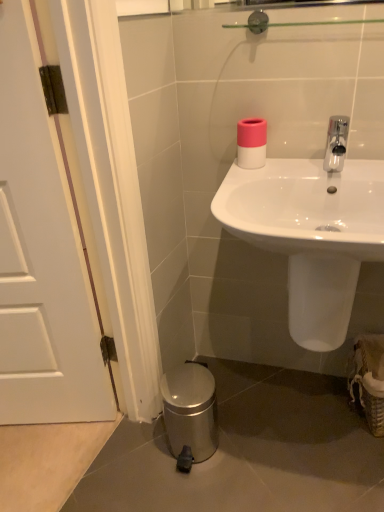
Question: Is woven straw basket at lower right located within polished chrome faucet at upper right?

Choices:
 (A) no
 (B) yes

Answer: (A)

Question: Is polished chrome faucet at upper right closer to the viewer compared to woven straw basket at lower right?

Choices:
 (A) no
 (B) yes

Answer: (B)

Question: From the image's perspective, is polished chrome faucet at upper right under woven straw basket at lower right?

Choices:
 (A) no
 (B) yes

Answer: (A)

Question: From a real-world perspective, is polished chrome faucet at upper right on top of woven straw basket at lower right?

Choices:
 (A) yes
 (B) no

Answer: (A)

Question: Is polished chrome faucet at upper right wider than woven straw basket at lower right?

Choices:
 (A) yes
 (B) no

Answer: (B)

Question: Does polished chrome faucet at upper right have a greater height compared to woven straw basket at lower right?

Choices:
 (A) yes
 (B) no

Answer: (B)

Question: Can you confirm if pink matte toilet paper at upper center is positioned to the right of polished chrome faucet at upper right?

Choices:
 (A) no
 (B) yes

Answer: (A)

Question: Is pink matte toilet paper at upper center shorter than polished chrome faucet at upper right?

Choices:
 (A) yes
 (B) no

Answer: (A)

Question: Considering the relative sizes of pink matte toilet paper at upper center and polished chrome faucet at upper right in the image provided, is pink matte toilet paper at upper center smaller than polished chrome faucet at upper right?

Choices:
 (A) no
 (B) yes

Answer: (B)

Question: Is there a large distance between pink matte toilet paper at upper center and polished chrome faucet at upper right?

Choices:
 (A) yes
 (B) no

Answer: (B)

Question: Considering the relative positions of pink matte toilet paper at upper center and polished chrome faucet at upper right in the image provided, is pink matte toilet paper at upper center in front of polished chrome faucet at upper right?

Choices:
 (A) yes
 (B) no

Answer: (B)

Question: Considering the relative sizes of pink matte toilet paper at upper center and polished chrome faucet at upper right in the image provided, is pink matte toilet paper at upper center taller than polished chrome faucet at upper right?

Choices:
 (A) yes
 (B) no

Answer: (B)

Question: From the image's perspective, is pink matte toilet paper at upper center located above white matte door at left?

Choices:
 (A) yes
 (B) no

Answer: (A)